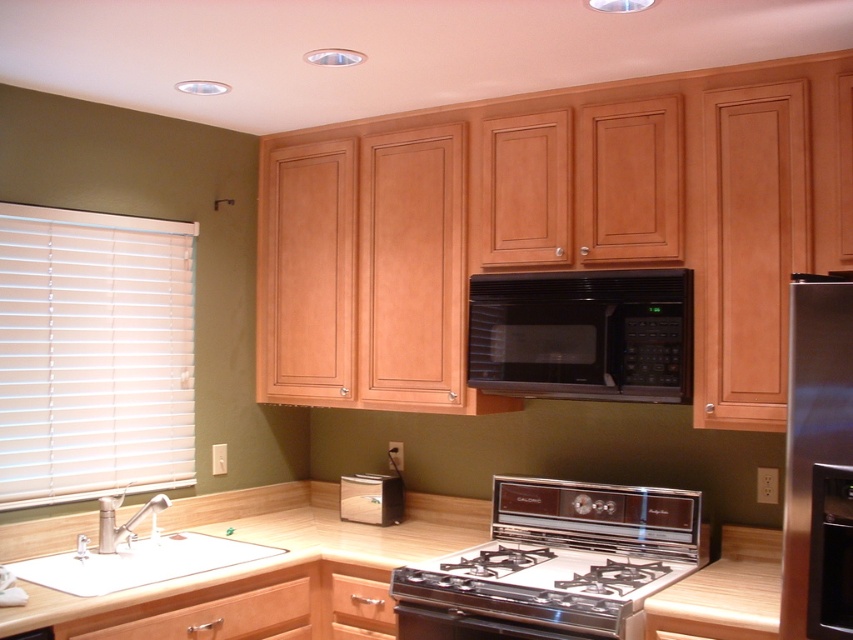
Question: Does white/smooth blinds at left come in front of wooden at lower center?

Choices:
 (A) yes
 (B) no

Answer: (B)

Question: Among these objects, which one is nearest to the camera?

Choices:
 (A) wooden at lower center
 (B) shiny silver gas stove at center

Answer: (A)

Question: Which point is closer to the camera?

Choices:
 (A) black matte microwave at center
 (B) wooden at lower center

Answer: (B)

Question: Can you confirm if wooden drawer at lower center is smaller than silver metallic faucet at sink left?

Choices:
 (A) no
 (B) yes

Answer: (B)

Question: Considering the relative positions of shiny silver gas stove at center and wooden drawer at lower center in the image provided, where is shiny silver gas stove at center located with respect to wooden drawer at lower center?

Choices:
 (A) above
 (B) below

Answer: (A)

Question: Which object is positioned closest to the light brown wood drawer at lower left?

Choices:
 (A) black stainless steel gas stove at center
 (B) white glossy sink at lower left
 (C) wooden at lower center

Answer: (C)